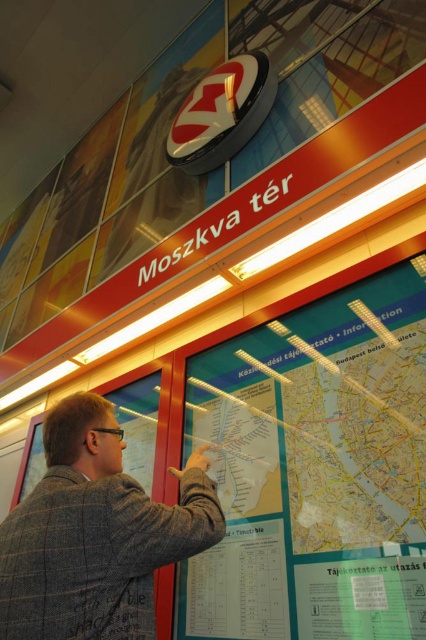
Is matte plastic map at center positioned behind gray woolen jacket at center?

Yes, matte plastic map at center is further from the viewer.

Is matte plastic map at center to the right of gray woolen jacket at center from the viewer's perspective?

Indeed, matte plastic map at center is positioned on the right side of gray woolen jacket at center.

Does point (362, 321) come behind point (60, 499)?

Yes, it is.

Locate an element on the screen. This screenshot has height=640, width=426. matte plastic map at center is located at coordinates (316, 468).